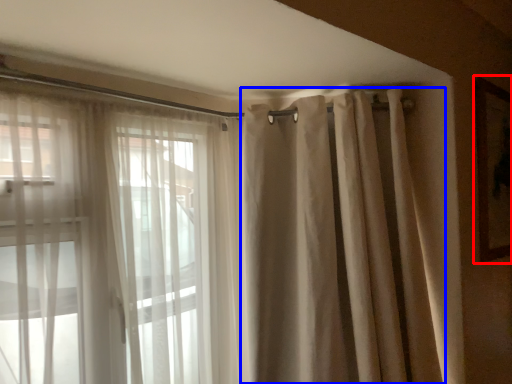
Question: Which of the following is the closest to the observer, picture frame (highlighted by a red box) or shower curtain (highlighted by a blue box)?

Choices:
 (A) picture frame
 (B) shower curtain

Answer: (B)